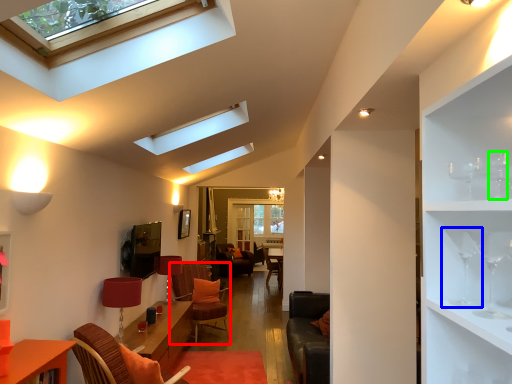
Question: Estimate the real-world distances between objects in this image. Which object is farther from swivel chair (highlighted by a red box), wine glass (highlighted by a blue box) or wine glass (highlighted by a green box)?

Choices:
 (A) wine glass
 (B) wine glass

Answer: (B)